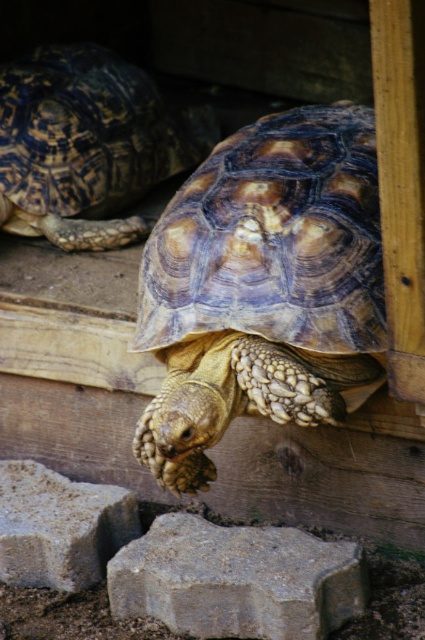
Question: Is brown textured shell at center to the right of shiny brown tortoise at upper left from the viewer's perspective?

Choices:
 (A) no
 (B) yes

Answer: (B)

Question: Does gray rough stone at lower center have a lesser width compared to gray textured stone at lower left?

Choices:
 (A) yes
 (B) no

Answer: (B)

Question: Which point appears closest to the camera in this image?

Choices:
 (A) (186, 392)
 (B) (45, 512)

Answer: (A)

Question: Can you confirm if gray rough stone at lower center is smaller than gray textured stone at lower left?

Choices:
 (A) no
 (B) yes

Answer: (A)

Question: Among these objects, which one is nearest to the camera?

Choices:
 (A) brown textured shell at center
 (B) gray textured stone at lower left
 (C) shiny brown tortoise at upper left

Answer: (A)

Question: Which of these objects is positioned closest to the brown textured shell at center?

Choices:
 (A) gray textured stone at lower left
 (B) shiny brown tortoise at upper left

Answer: (A)